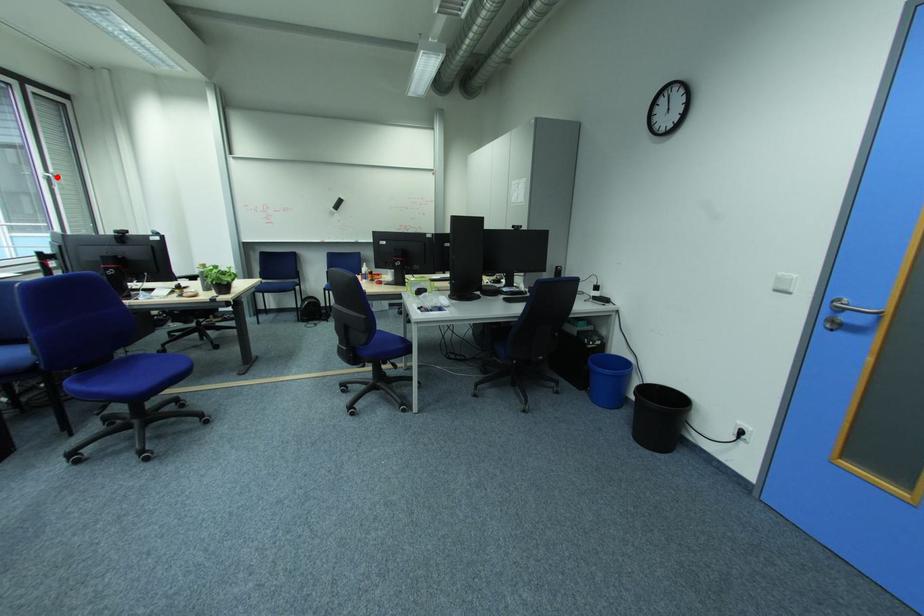
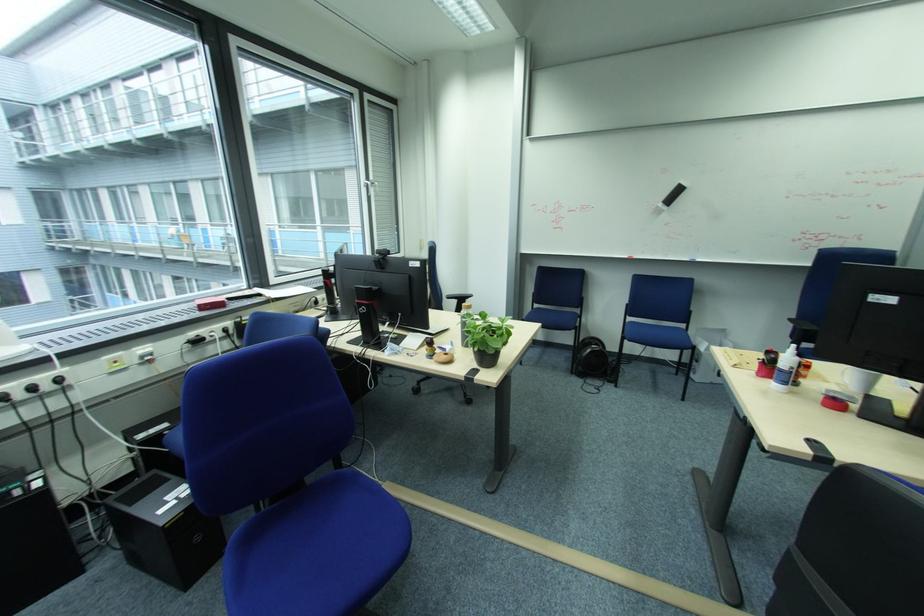
Locate, in the second image, the point that corresponds to the highlighted location in the first image.

(377, 184)